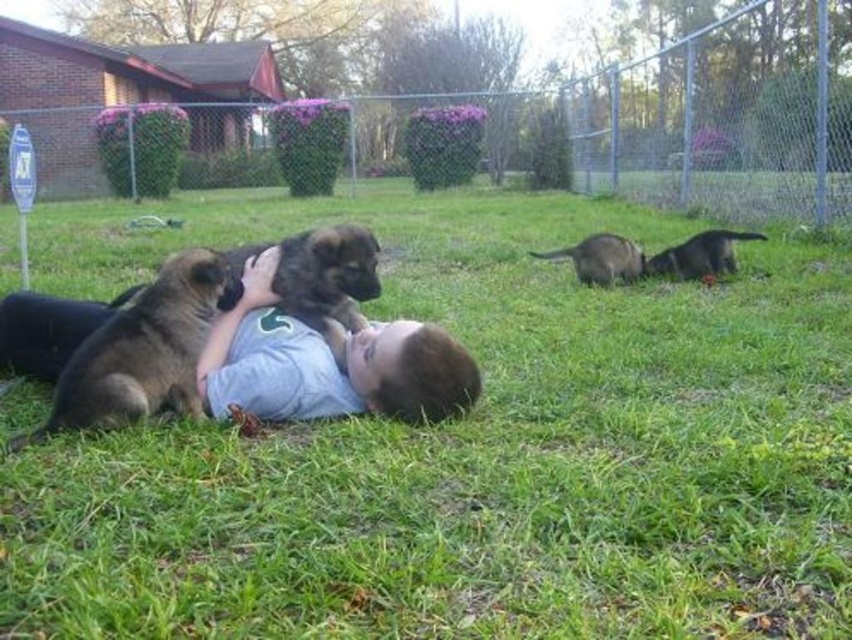
Is point (272, 358) positioned in front of point (680, 250)?

Yes, it is in front of point (680, 250).

Does light blue shirt at center appear under brown fur dog at right?

Yes, light blue shirt at center is below brown fur dog at right.

Between point (453, 365) and point (648, 266), which one is positioned behind?

The point (648, 266) is behind.

Where is `light blue shirt at center`? light blue shirt at center is located at coordinates (325, 364).

Does point (168, 248) come farther from viewer compared to point (68, 400)?

Yes, point (168, 248) is farther from viewer.

Does green grass at center appear on the left side of light blue shirt at center?

Yes, green grass at center is to the left of light blue shirt at center.

Between point (348, 205) and point (439, 376), which one is positioned in front?

Point (439, 376) is in front.

Identify the location of green grass at center. (468, 449).

Where is `green grass at center`? green grass at center is located at coordinates (468, 449).

Is point (602, 436) closer to viewer compared to point (93, 371)?

Yes, it is.

Locate an element on the screen. green grass at center is located at coordinates (468, 449).